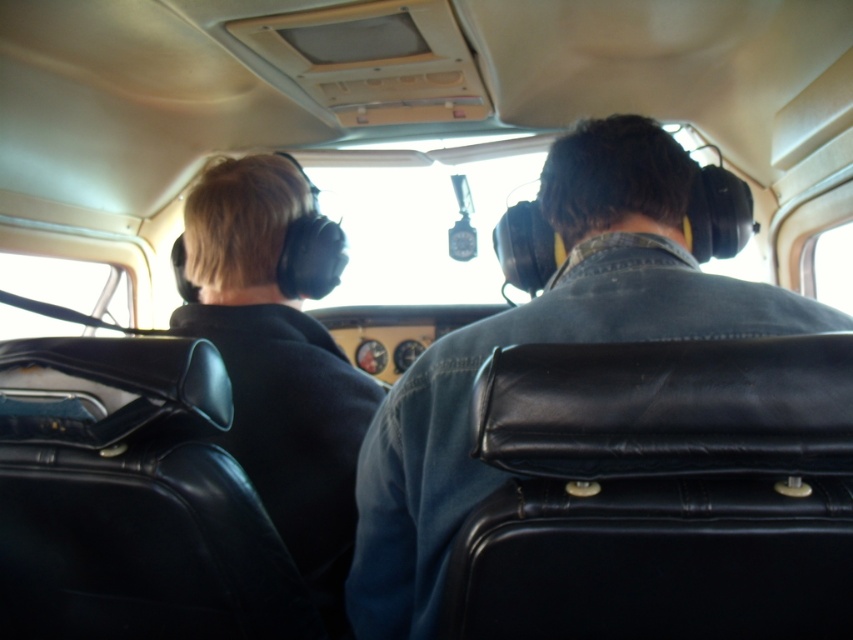
Is black leather suitcase at center wider than denim jacket at center?

Incorrect, black leather suitcase at center's width does not surpass denim jacket at center's.

Who is more distant from viewer, (606, 388) or (764, 296)?

Point (764, 296)

Describe the element at coordinates (660, 492) in the screenshot. I see `black leather suitcase at center` at that location.

This screenshot has width=853, height=640. In order to click on black leather suitcase at center in this screenshot , I will do `click(660, 492)`.